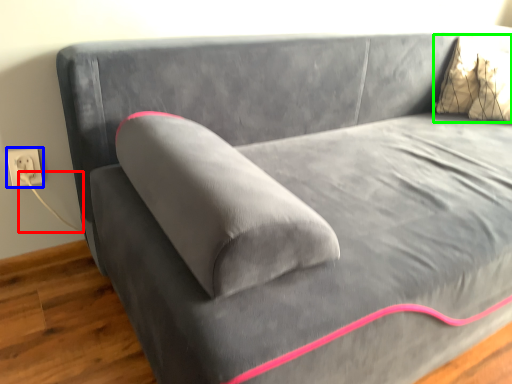
Question: Which is farther away from string (highlighted by a red box)? electric outlet (highlighted by a blue box) or pillow (highlighted by a green box)?

Choices:
 (A) electric outlet
 (B) pillow

Answer: (B)